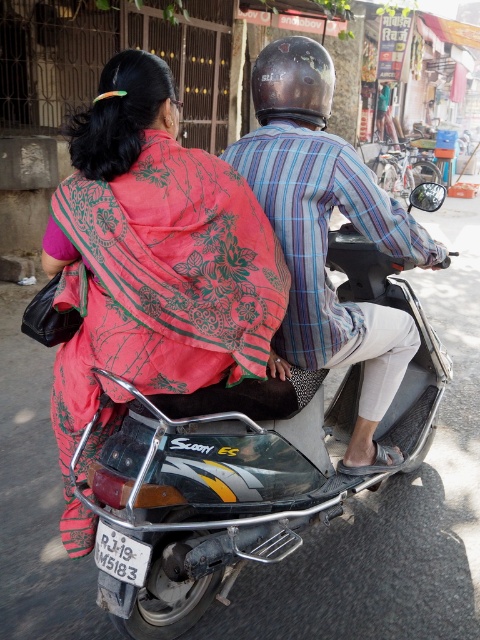
Is matte pink saree at center below metallic silver scooter at center?

No.

Is point (160, 68) positioned before point (217, 541)?

Yes, point (160, 68) is closer to viewer.

From the picture: Who is more forward, (184, 250) or (208, 595)?

Point (184, 250)

The height and width of the screenshot is (640, 480). Identify the location of matte pink saree at center. point(151,268).

Does metallic silver scooter at center have a smaller size compared to striped fabric shirt at center?

Actually, metallic silver scooter at center might be larger than striped fabric shirt at center.

Is metallic silver scooter at center behind striped fabric shirt at center?

No, it is not.

Between point (173, 579) and point (362, 435), which one is positioned in front?

Point (173, 579) is in front.

At what (x,y) coordinates should I click in order to perform the action: click on metallic silver scooter at center. Please return your answer as a coordinate pair (x, y). Looking at the image, I should click on click(243, 467).

At what (x,y) coordinates should I click in order to perform the action: click on matte pink saree at center. Please return your answer as a coordinate pair (x, y). This screenshot has height=640, width=480. Looking at the image, I should click on (151, 268).

What do you see at coordinates (151, 268) in the screenshot? This screenshot has width=480, height=640. I see `matte pink saree at center` at bounding box center [151, 268].

Between point (136, 243) and point (295, 218), which one is positioned in front?

Point (136, 243) is more forward.

At what (x,y) coordinates should I click in order to perform the action: click on matte pink saree at center. Please return your answer as a coordinate pair (x, y). Looking at the image, I should click on (151, 268).